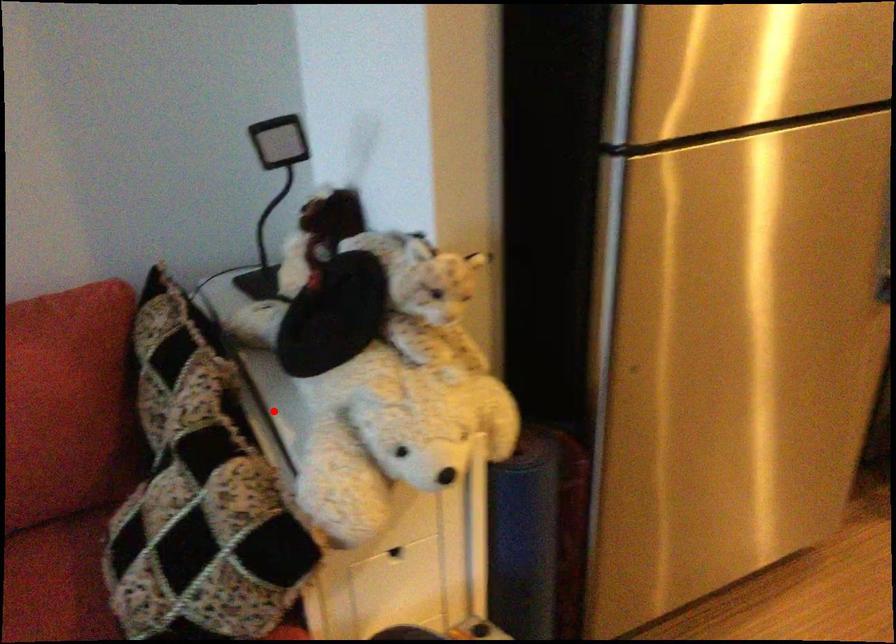
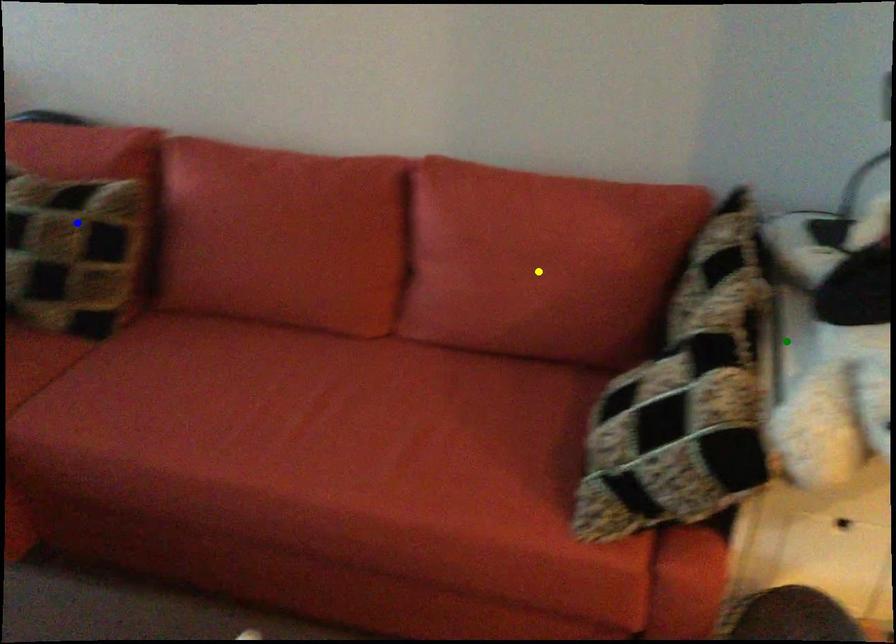
Question: I am providing you with two images of the same scene from different viewpoints. A red point is marked on the first image. You are given multiple points on the second image. Which point in image 2 is actually the same real-world point as the red point in image 1?

Choices:
 (A) yellow point
 (B) blue point
 (C) green point

Answer: (C)